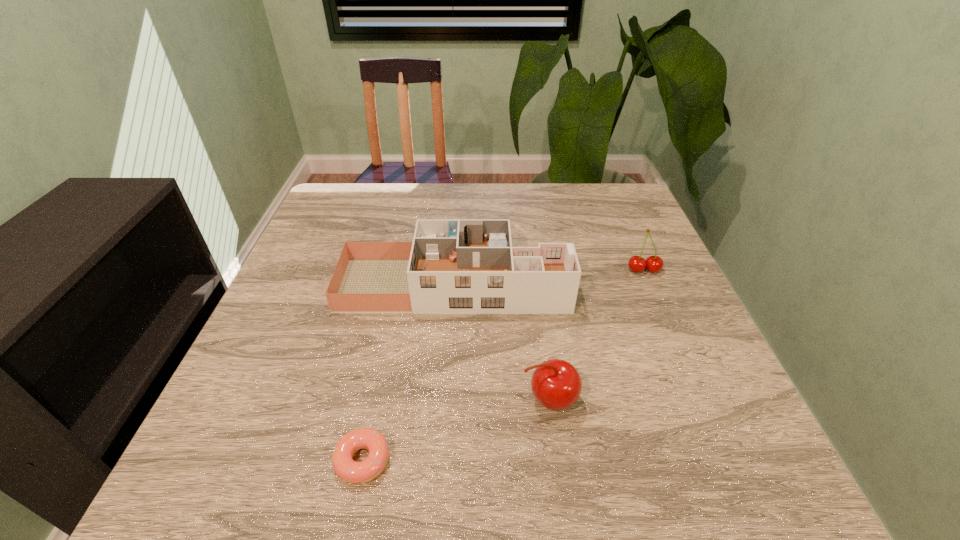
This screenshot has height=540, width=960. In order to click on dollhouse in this screenshot , I will do `click(453, 266)`.

Find the location of a particular element. This screenshot has height=540, width=960. the right cherry is located at coordinates (654, 264).

The image size is (960, 540). What are the coordinates of `the farther cherry` in the screenshot? It's located at (654, 264).

Locate an element on the screen. the second nearest object is located at coordinates (556, 384).

Locate an element on the screen. the nearer cherry is located at coordinates (556, 384).

Locate an element on the screen. The height and width of the screenshot is (540, 960). the shortest object is located at coordinates (351, 471).

Identify the location of doughnut. pos(351,471).

What are the coordinates of `vacant space located at the front door of the dollhouse` in the screenshot? It's located at [636, 285].

Find the location of a particular element. free space located 0.050m with the stems of the rightmost object pointing upwards is located at coordinates (653, 290).

At what (x,y) coordinates should I click in order to perform the action: click on free spot located 0.290m on the left of the left cherry. Please return your answer as a coordinate pair (x, y). The width and height of the screenshot is (960, 540). Looking at the image, I should click on (359, 400).